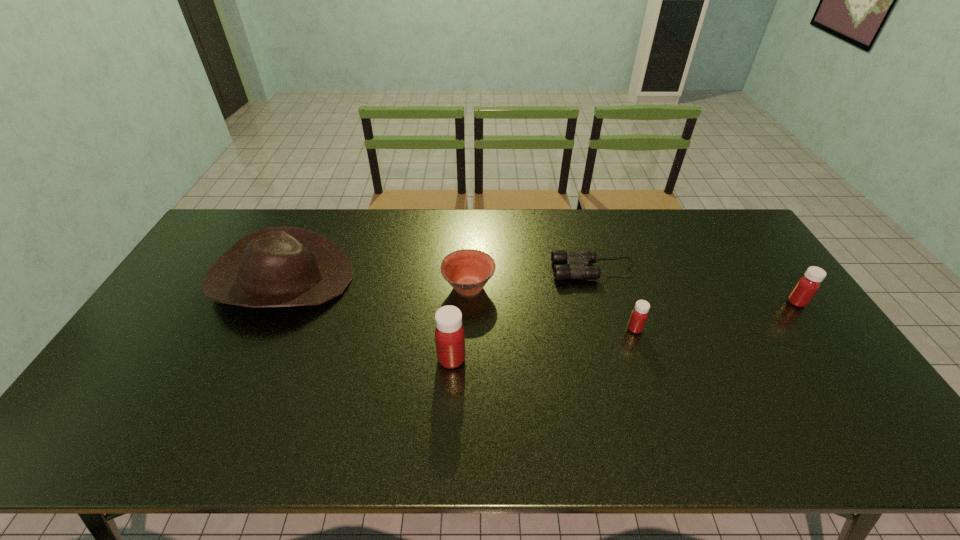
Where is `free space that satisfies the following two spatial constraints: 1. at the eyepiece of the binoculars; 2. on the front side of the cowboy hat`? free space that satisfies the following two spatial constraints: 1. at the eyepiece of the binoculars; 2. on the front side of the cowboy hat is located at coordinates (598, 280).

Find the location of a particular element. This screenshot has height=540, width=960. vacant space that satisfies the following two spatial constraints: 1. on the back side of the rightmost medicine; 2. on the right side of the second nearest medicine is located at coordinates (626, 302).

Find the location of `free location that satisfies the following two spatial constraints: 1. on the front side of the cowboy hat; 2. on the right side of the rightmost object`. free location that satisfies the following two spatial constraints: 1. on the front side of the cowboy hat; 2. on the right side of the rightmost object is located at coordinates (272, 302).

Locate an element on the screen. The width and height of the screenshot is (960, 540). free location that satisfies the following two spatial constraints: 1. at the eyepiece of the shortest medicine; 2. on the right side of the binoculars is located at coordinates (612, 329).